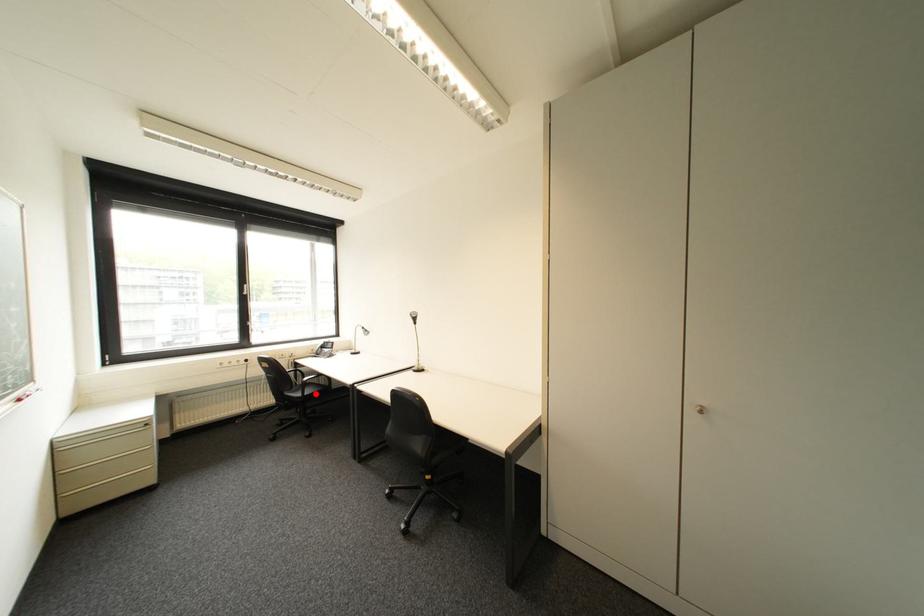
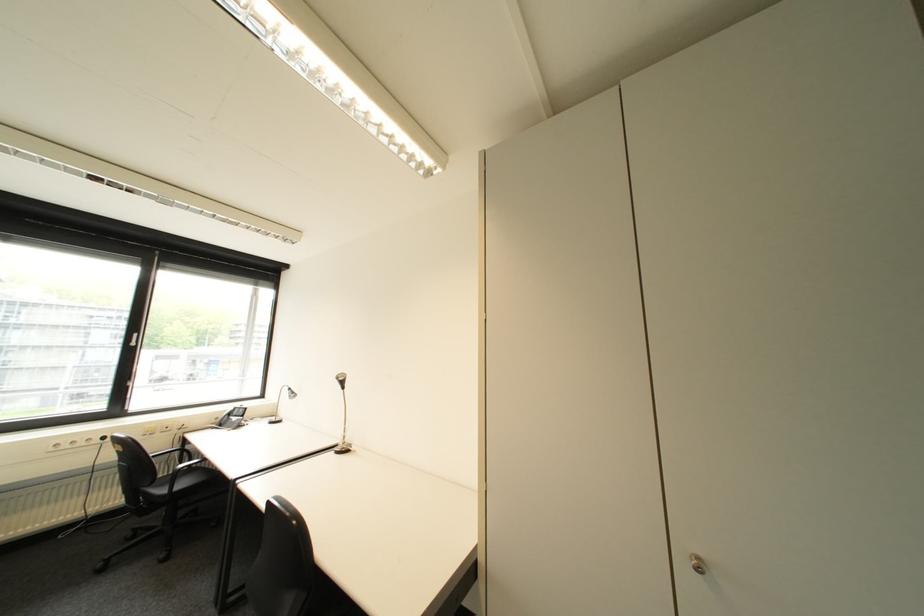
Question: I am providing you with two images of the same scene from different viewpoints. Image1 has a red point marked. In image2, the corresponding 3D location appears at what relative position? Reply with the corresponding letter.

Choices:
 (A) Closer
 (B) Farther

Answer: (A)